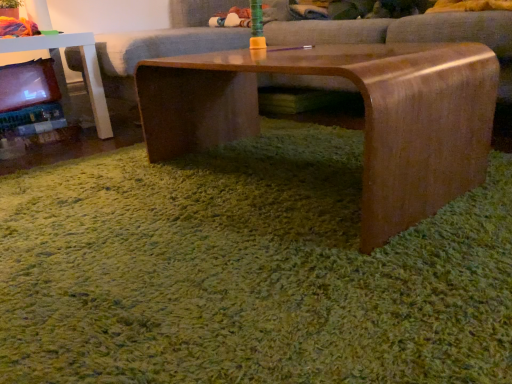
Where is `blank space situated above green shaggy carpet at center (from a real-world perspective)`? The height and width of the screenshot is (384, 512). blank space situated above green shaggy carpet at center (from a real-world perspective) is located at coordinates (219, 197).